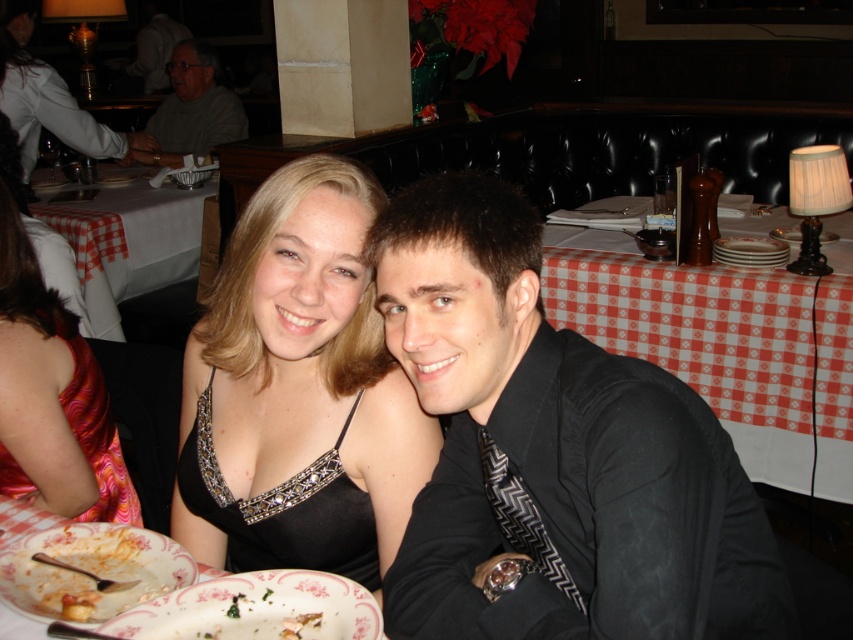
Question: Considering the real-world distances, which object is closest to the gray sweater at upper left?

Choices:
 (A) red checkered tablecloth at upper right
 (B) black satin shirt at center
 (C) pink porcelain plate at lower center
 (D) orange printed dress at left

Answer: (A)

Question: Which of these objects is positioned farthest from the white glossy platter at upper right?

Choices:
 (A) porcelain floral plate at lower left
 (B) red checkered tablecloth at upper right

Answer: (A)

Question: Among these objects, which one is farthest from the camera?

Choices:
 (A) gray sweater at upper left
 (B) orange printed dress at left
 (C) pink porcelain plate at lower center
 (D) black satin dress at center

Answer: (A)

Question: From the image, what is the correct spatial relationship of orange printed dress at left in relation to red checkered tablecloth at center?

Choices:
 (A) below
 (B) above

Answer: (A)

Question: Can you confirm if black satin shirt at center is thinner than pink porcelain plate at lower center?

Choices:
 (A) yes
 (B) no

Answer: (B)

Question: Where is black satin shirt at center located in relation to porcelain floral plate at lower left in the image?

Choices:
 (A) below
 (B) above

Answer: (B)